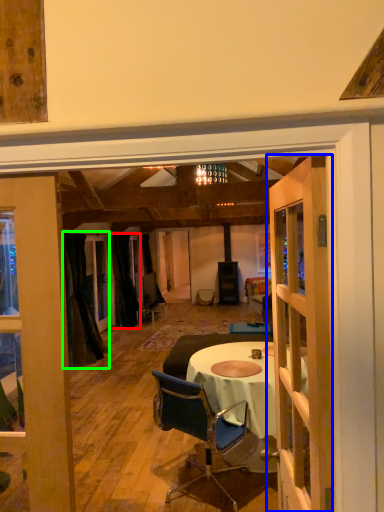
Question: Considering the real-world distances, which object is closest to curtain (highlighted by a red box)? door (highlighted by a blue box) or curtain (highlighted by a green box).

Choices:
 (A) door
 (B) curtain

Answer: (B)